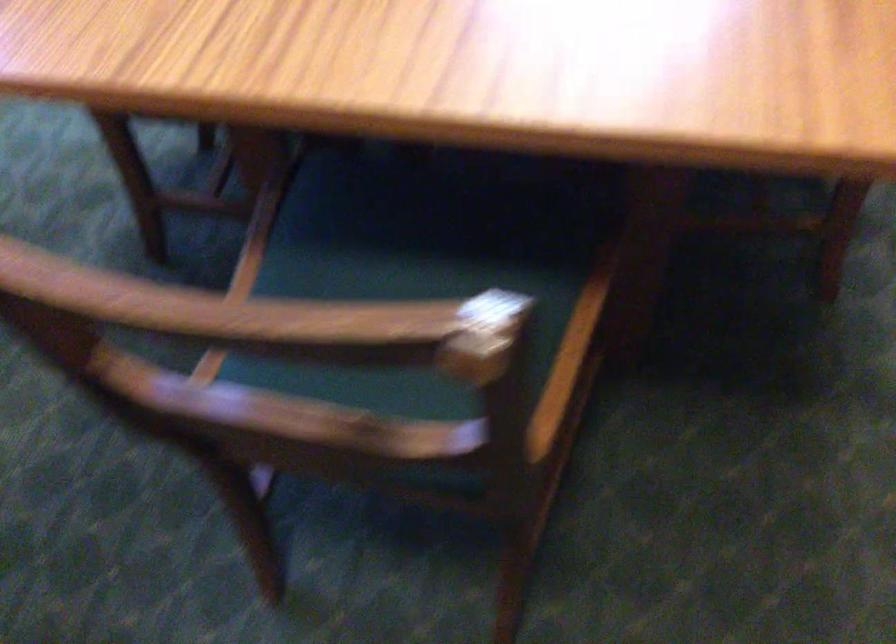
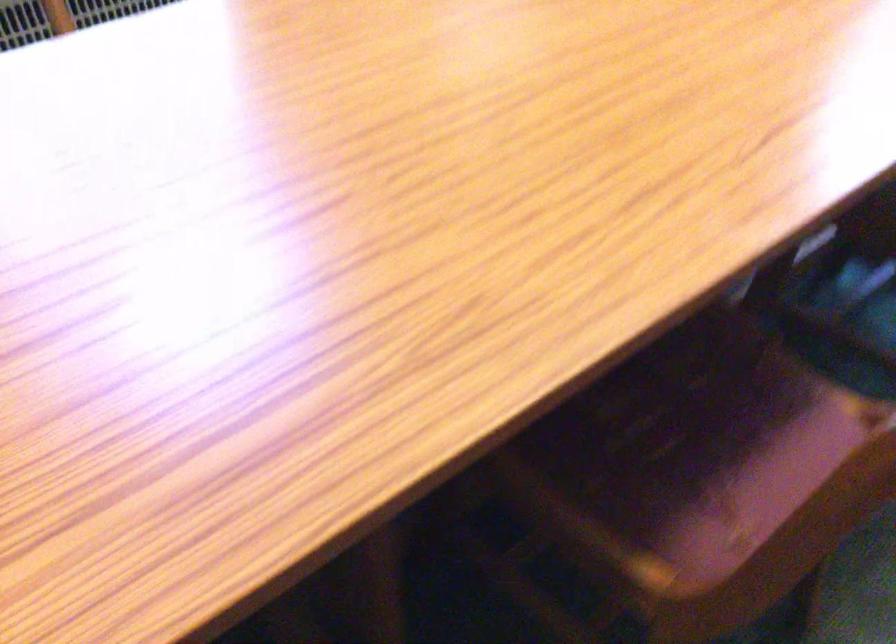
Question: The images are taken continuously from a first-person perspective. In which direction is your viewpoint rotating?

Choices:
 (A) Left
 (B) Right
 (C) Up
 (D) Down

Answer: (A)